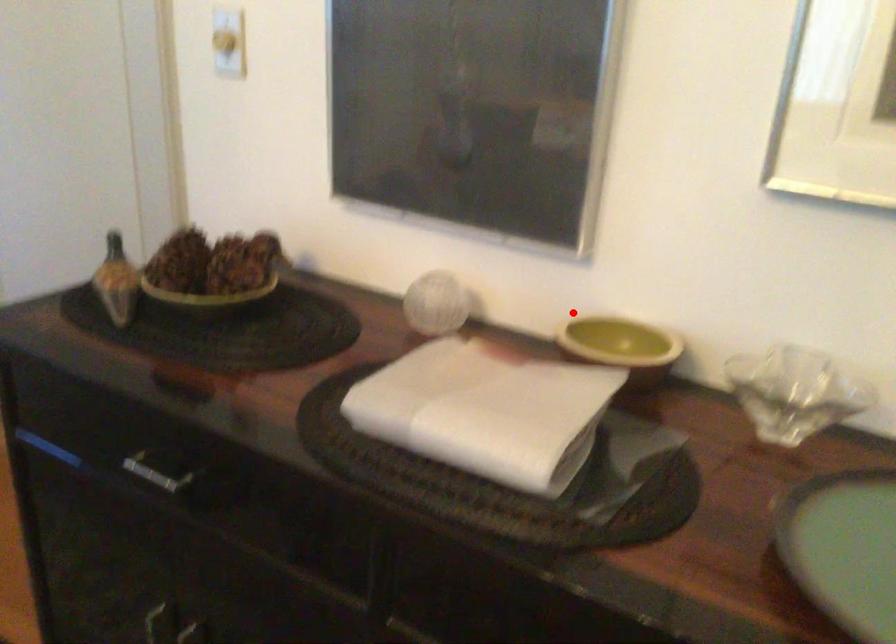
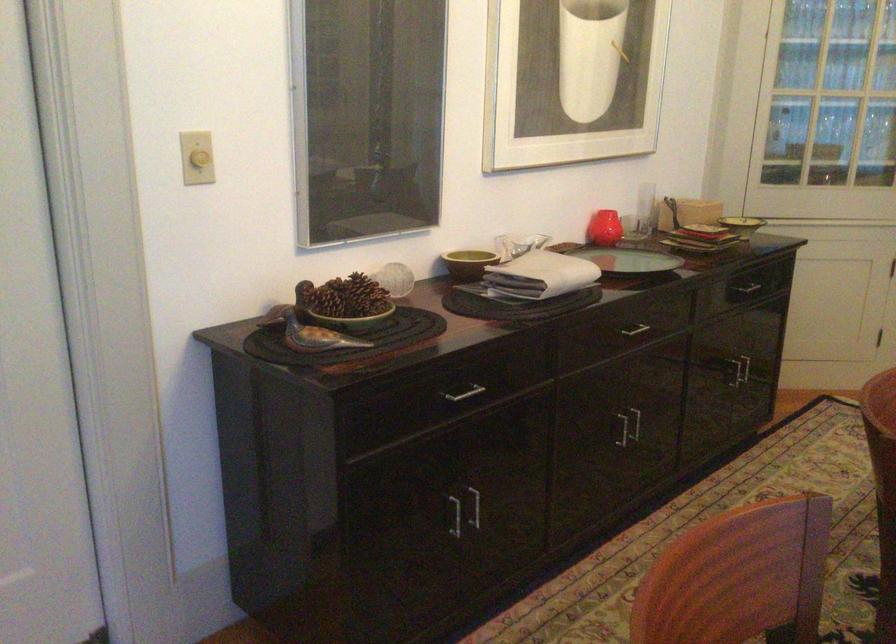
The point at the highlighted location is marked in the first image. Where is the corresponding point in the second image?

(468, 263)